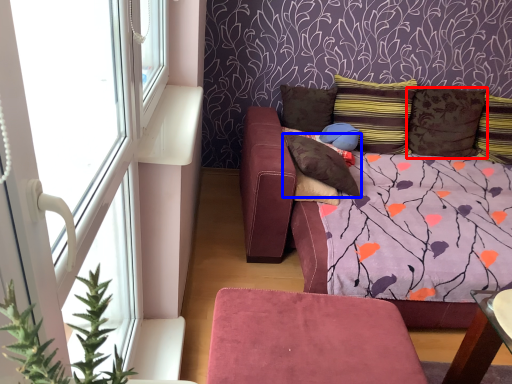
Question: Among these objects, which one is farthest to the camera, pillow (highlighted by a red box) or pillow (highlighted by a blue box)?

Choices:
 (A) pillow
 (B) pillow

Answer: (A)